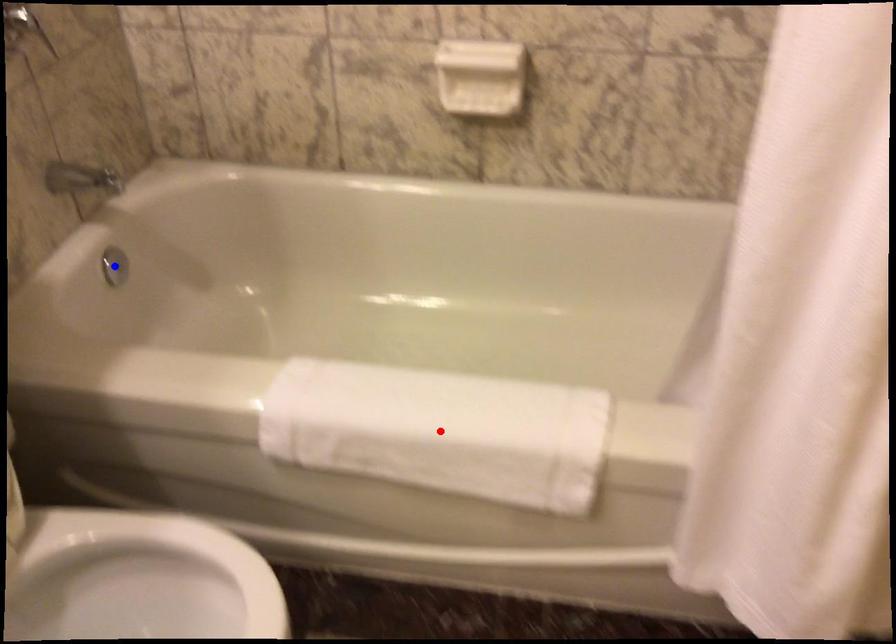
Question: Two points are marked on the image. Which point is closer to the camera?

Choices:
 (A) Blue point is closer.
 (B) Red point is closer.

Answer: (B)